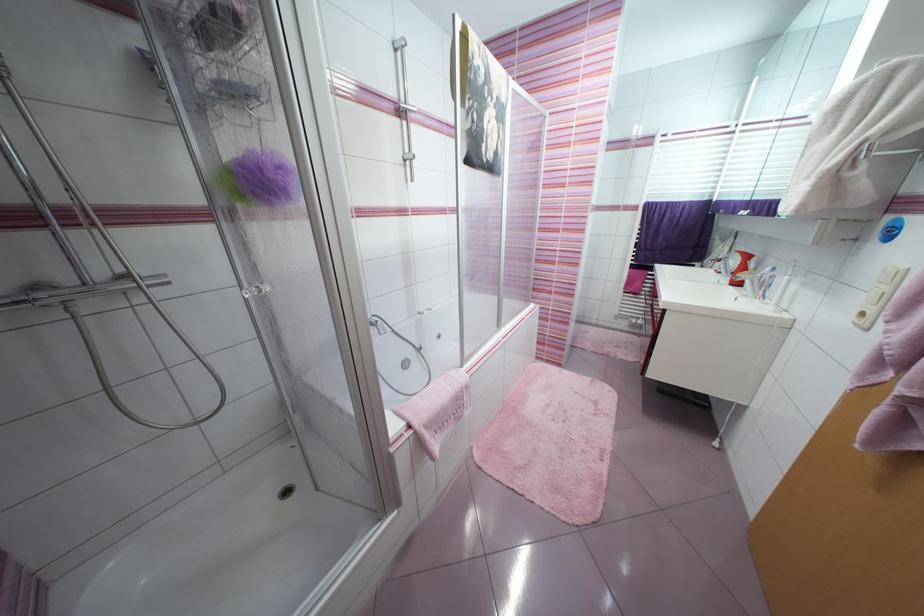
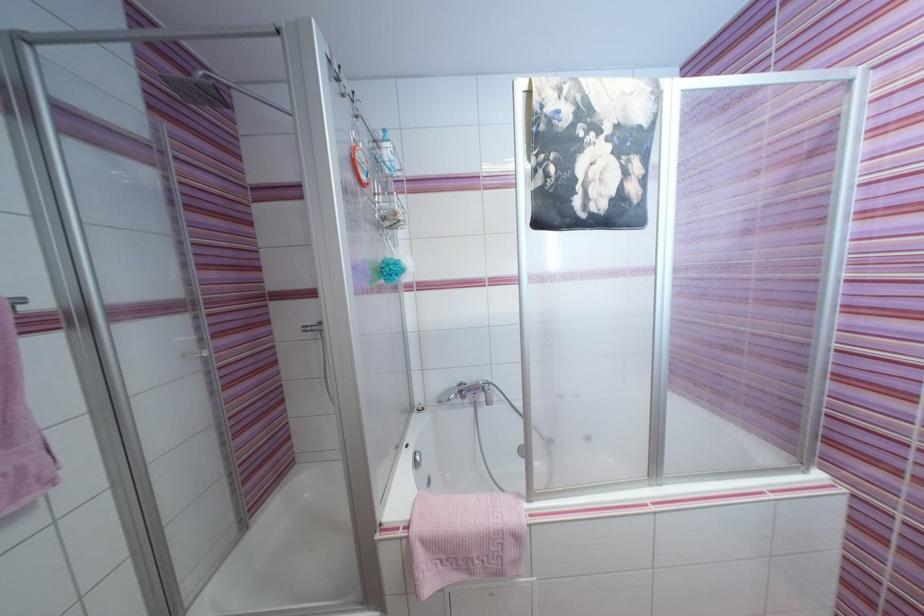
Locate, in the second image, the point that corresponds to pixel 495 156 in the first image.

(604, 208)